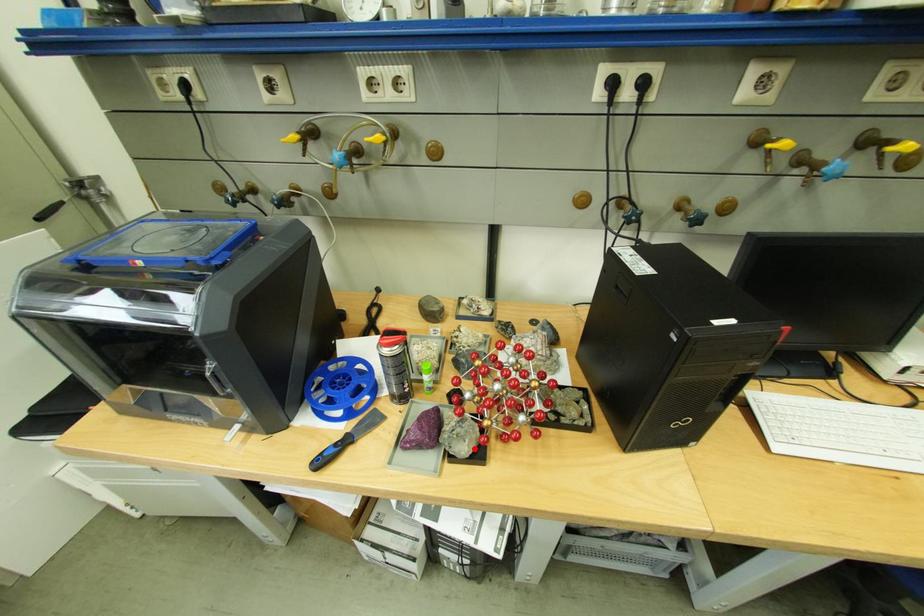
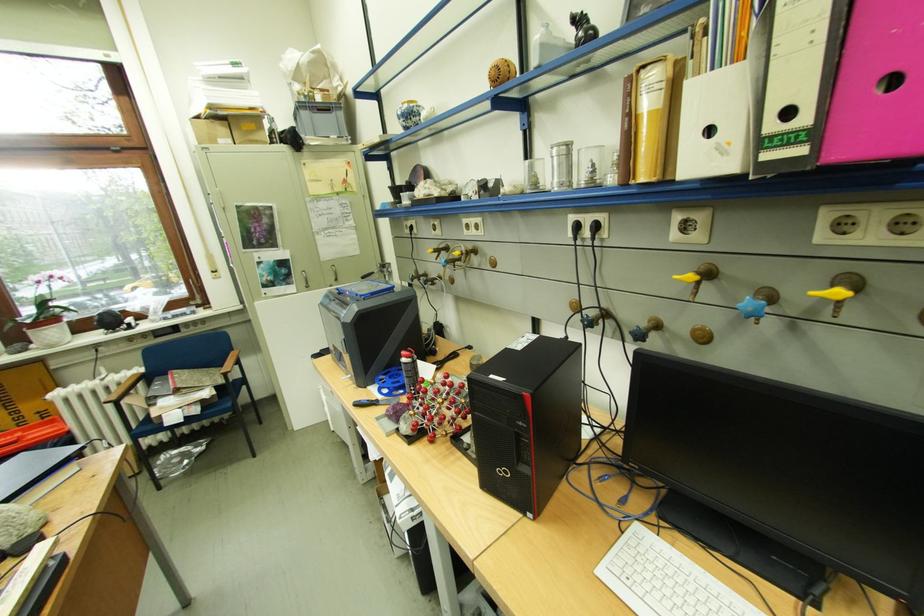
In the second image, find the point that corresponds to the highlighted location in the first image.

(415, 429)